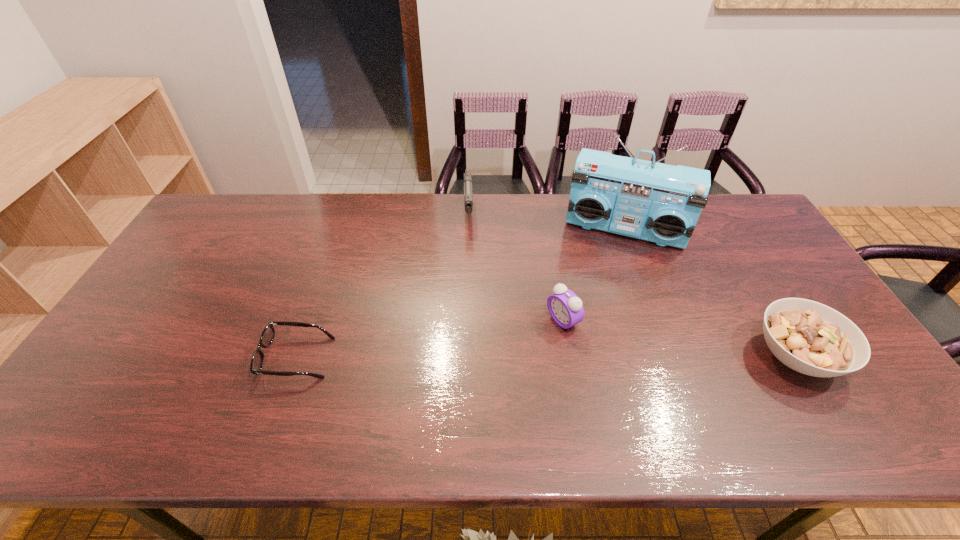
You are a GUI agent. You are given a task and a screenshot of the screen. Output one action in this format:
    pyautogui.click(x=<x>, y=<y>)
    Task: Click on the vacant space that is in between the alarm clock and the second object from left to right
    This screenshot has height=540, width=960.
    Given the screenshot: What is the action you would take?
    pyautogui.click(x=516, y=266)

Locate an element on the screen. Image resolution: width=960 pixels, height=540 pixels. free space that is in between the tallest object and the third object from right to left is located at coordinates (594, 275).

Image resolution: width=960 pixels, height=540 pixels. What are the coordinates of `free space between the stew and the alarm clock` in the screenshot? It's located at (680, 339).

I want to click on vacant area that lies between the fourth object from right to left and the third object from right to left, so click(516, 266).

Locate an element on the screen. free spot between the stew and the gun is located at coordinates (632, 284).

I want to click on vacant area that lies between the radio receiver and the shortest object, so click(x=461, y=294).

Find the location of a particular element. vacant area that lies between the gun and the alarm clock is located at coordinates (516, 266).

Find the location of a particular element. The width and height of the screenshot is (960, 540). vacant point located between the radio receiver and the gun is located at coordinates (546, 221).

Locate an element on the screen. vacant area that lies between the alarm clock and the stew is located at coordinates (680, 339).

You are a GUI agent. You are given a task and a screenshot of the screen. Output one action in this format:
    pyautogui.click(x=<x>, y=<y>)
    Task: Click on the fourth closest object to the third object from left to right
    
    Given the screenshot: What is the action you would take?
    pyautogui.click(x=268, y=334)